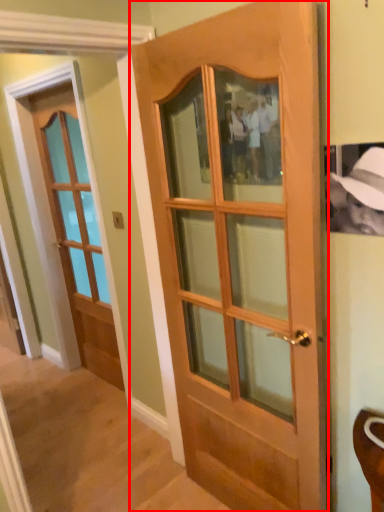
Question: From the image, what is the correct spatial relationship of door (annotated by the red box) in relation to door?

Choices:
 (A) left
 (B) right

Answer: (B)